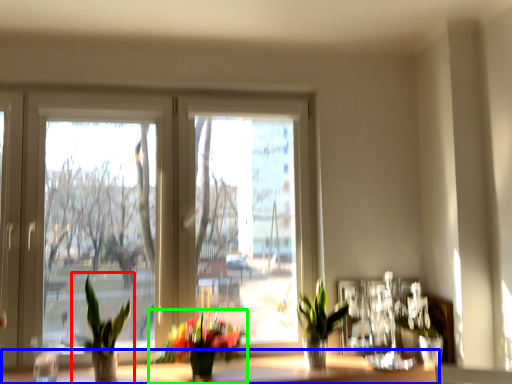
Question: Which object is positioned farthest from houseplant (highlighted by a red box)? Select from window sill (highlighted by a blue box) and houseplant (highlighted by a green box).

Choices:
 (A) window sill
 (B) houseplant

Answer: (A)